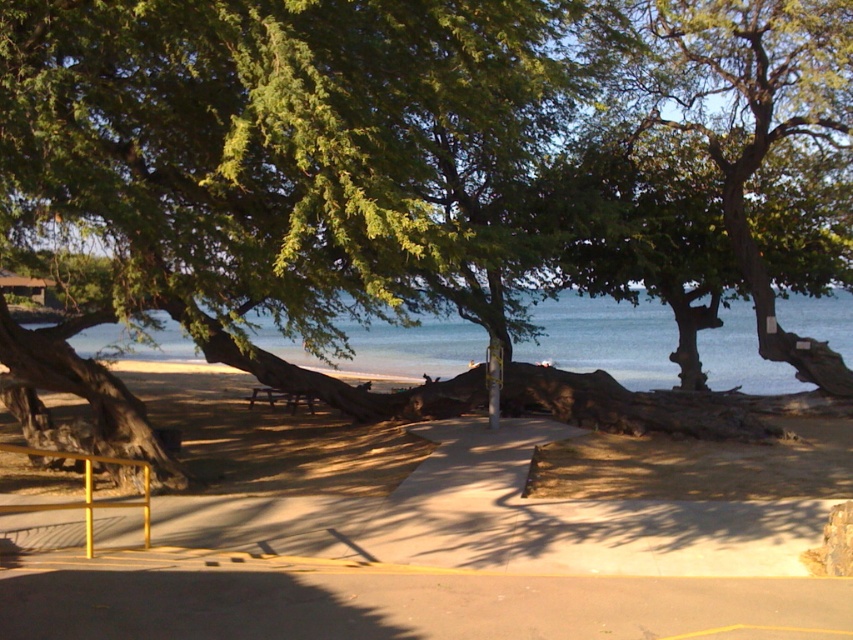
Question: Which point appears farthest from the camera in this image?

Choices:
 (A) (276, 396)
 (B) (804, 435)
 (C) (291, 358)
 (D) (518, 72)

Answer: (C)

Question: Does beige sand at lower center have a lesser width compared to blue water at center?

Choices:
 (A) yes
 (B) no

Answer: (A)

Question: Is green leafy tree at center to the left of beige sand at lower center from the viewer's perspective?

Choices:
 (A) no
 (B) yes

Answer: (B)

Question: Among these objects, which one is farthest from the camera?

Choices:
 (A) green leafy tree at center
 (B) wooden picnic table at center
 (C) blue water at center
 (D) beige sand at lower center

Answer: (B)

Question: Does beige sand at lower center come in front of blue water at center?

Choices:
 (A) yes
 (B) no

Answer: (A)

Question: Which point is farther to the camera?

Choices:
 (A) (494, 193)
 (B) (67, 532)

Answer: (A)